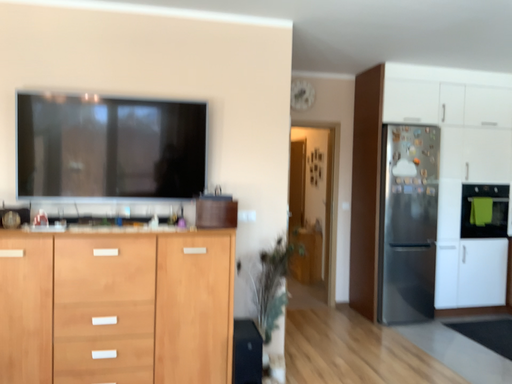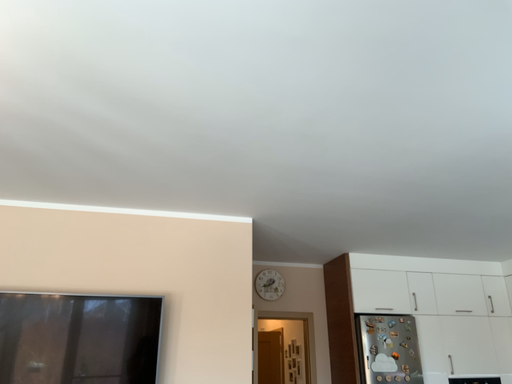
Question: How did the camera likely rotate when shooting the video?

Choices:
 (A) rotated upward
 (B) rotated downward

Answer: (A)